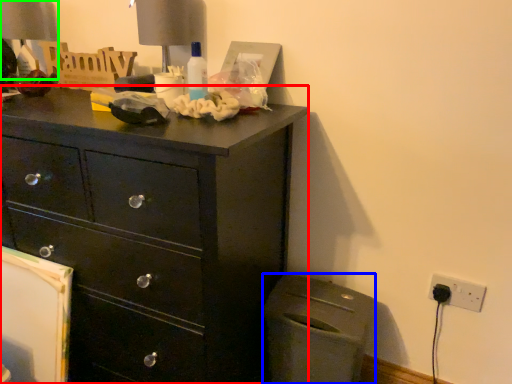
Question: Which is farther away from chest of drawers (highlighted by a red box)? cabinetry (highlighted by a blue box) or table lamp (highlighted by a green box)?

Choices:
 (A) cabinetry
 (B) table lamp

Answer: (B)